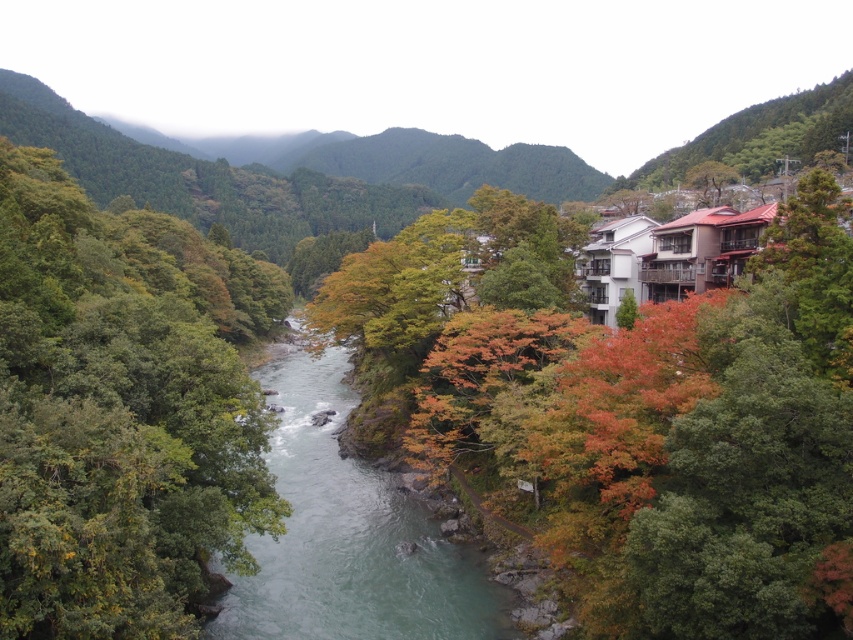
Does green leafy trees at left come behind clear water at center?

No, it is in front of clear water at center.

Between green leafy trees at left and clear water at center, which one is positioned higher?

green leafy trees at left is higher up.

Is point (25, 561) closer to camera compared to point (314, 374)?

Yes.

Locate an element on the screen. This screenshot has height=640, width=853. green leafy trees at left is located at coordinates (120, 412).

Is autumn leaves at center to the left of clear water at center from the viewer's perspective?

Incorrect, autumn leaves at center is not on the left side of clear water at center.

Identify the location of autumn leaves at center. (633, 422).

Where is `autumn leaves at center`? autumn leaves at center is located at coordinates (633, 422).

Is autumn leaves at center in front of green leafy trees at left?

No, it is behind green leafy trees at left.

Can you confirm if autumn leaves at center is taller than green leafy trees at left?

Incorrect, autumn leaves at center's height is not larger of green leafy trees at left's.

Between point (717, 444) and point (277, 269), which one is positioned in front?

Point (717, 444) is more forward.

The height and width of the screenshot is (640, 853). I want to click on autumn leaves at center, so click(633, 422).